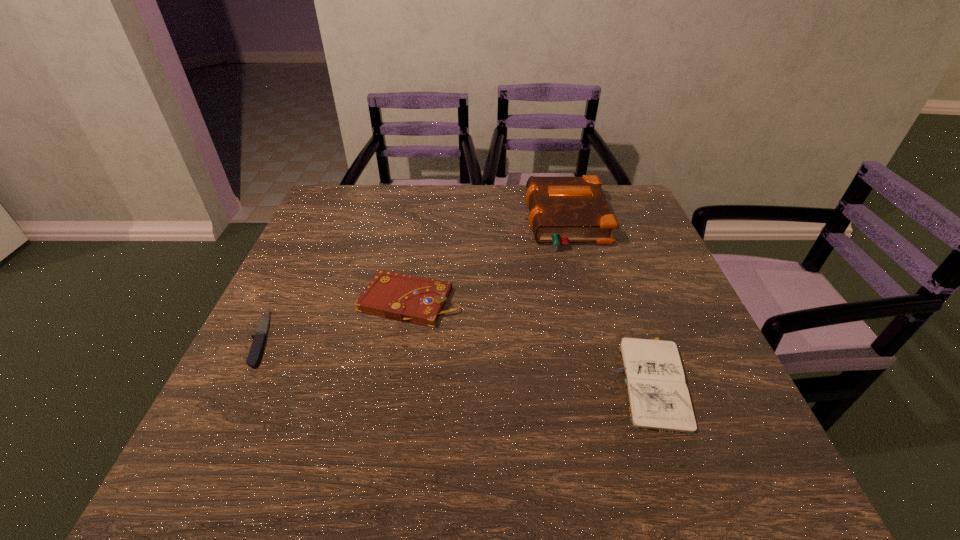
Where is `free space that is in between the farther notebook and the steak knife`? This screenshot has height=540, width=960. free space that is in between the farther notebook and the steak knife is located at coordinates (336, 320).

Where is `blank region between the third object from right to left and the leftmost object`? This screenshot has width=960, height=540. blank region between the third object from right to left and the leftmost object is located at coordinates (336, 320).

The height and width of the screenshot is (540, 960). I want to click on vacant space in between the second tallest object and the third tallest object, so click(531, 341).

Image resolution: width=960 pixels, height=540 pixels. In order to click on free spot between the nearer notebook and the third shortest object in this screenshot , I will do 531,341.

At what (x,y) coordinates should I click in order to perform the action: click on free space between the third tallest object and the shortest object. Please return your answer as a coordinate pair (x, y). Looking at the image, I should click on (457, 360).

Point out which object is positioned as the nearest to the leftmost object. Please provide its 2D coordinates. Your answer should be formatted as a tuple, i.e. [(x, y)], where the tuple contains the x and y coordinates of a point satisfying the conditions above.

[(402, 297)]

I want to click on object that can be found as the third closest to the second object from left to right, so click(x=658, y=397).

Where is `vacant space that satisfies the following two spatial constraints: 1. on the back side of the shortest object; 2. on the right side of the taller notebook`? The image size is (960, 540). vacant space that satisfies the following two spatial constraints: 1. on the back side of the shortest object; 2. on the right side of the taller notebook is located at coordinates (280, 300).

Identify the location of free space that satisfies the following two spatial constraints: 1. on the front side of the third object from right to left; 2. on the left side of the shorter notebook. The width and height of the screenshot is (960, 540). (396, 381).

Locate an element on the screen. The width and height of the screenshot is (960, 540). vacant region that satisfies the following two spatial constraints: 1. on the spine side of the tallest object; 2. on the left side of the right notebook is located at coordinates (608, 381).